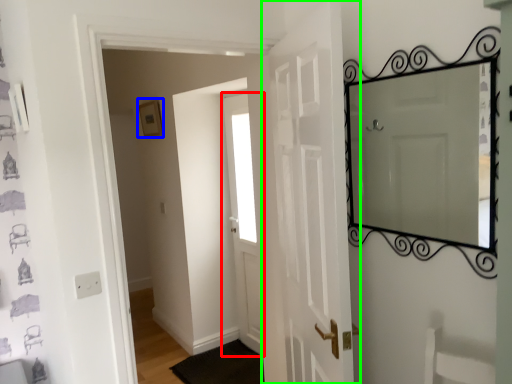
Question: Based on their relative distances, which object is farther from door (highlighted by a red box)? Choose from picture frame (highlighted by a blue box) and door (highlighted by a green box).

Choices:
 (A) picture frame
 (B) door

Answer: (B)